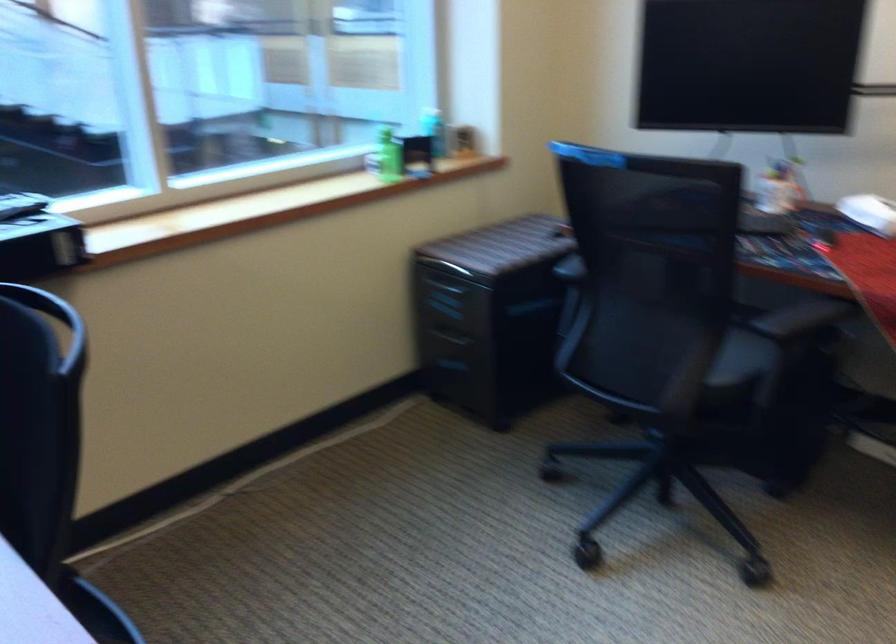
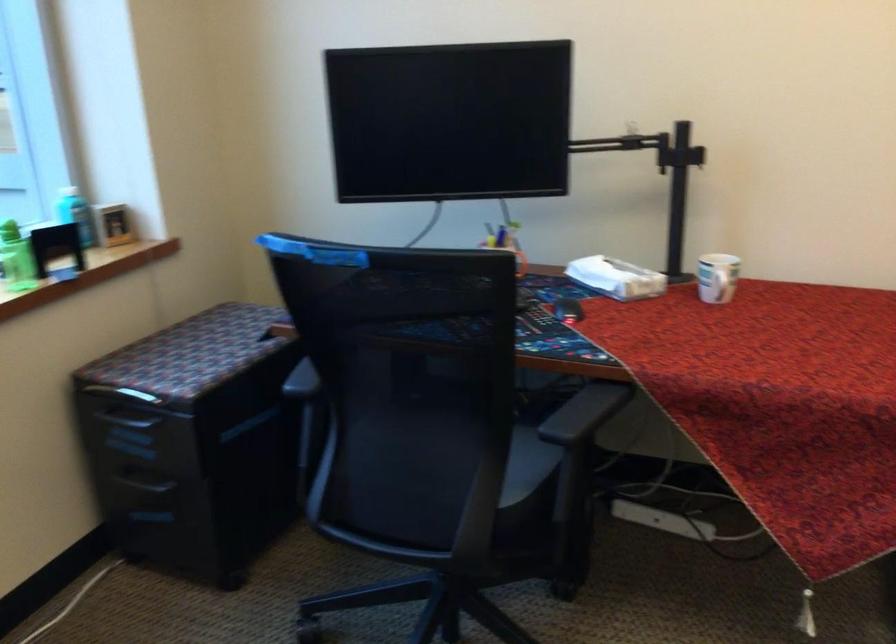
Question: The images are taken continuously from a first-person perspective. In which direction are you moving?

Choices:
 (A) Left
 (B) Right
 (C) Forward
 (D) Backward

Answer: (C)